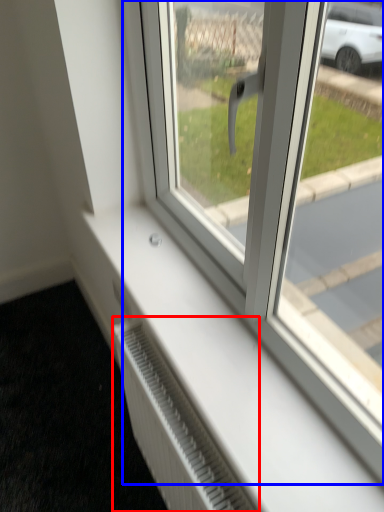
Question: Which object appears closest to the camera in this image, radiator (highlighted by a red box) or window (highlighted by a blue box)?

Choices:
 (A) radiator
 (B) window

Answer: (B)